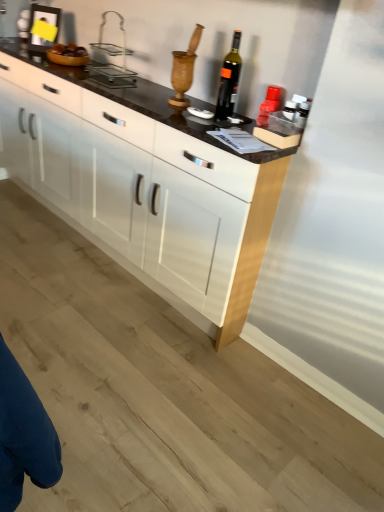
Question: From a real-world perspective, does white glossy cabinet at center stand above clear plastic basket at upper center?

Choices:
 (A) yes
 (B) no

Answer: (B)

Question: Is clear plastic basket at upper center a part of white glossy cabinet at center?

Choices:
 (A) no
 (B) yes

Answer: (A)

Question: Is white glossy cabinet at center taller than clear plastic basket at upper center?

Choices:
 (A) yes
 (B) no

Answer: (A)

Question: Is white glossy cabinet at center looking in the opposite direction of clear plastic basket at upper center?

Choices:
 (A) yes
 (B) no

Answer: (B)

Question: Does white glossy cabinet at center appear on the right side of clear plastic basket at upper center?

Choices:
 (A) no
 (B) yes

Answer: (A)

Question: Does white glossy cabinet at center turn towards clear plastic basket at upper center?

Choices:
 (A) no
 (B) yes

Answer: (A)

Question: Considering the relative positions of dark glass bottle at center and clear plastic basket at upper center in the image provided, is dark glass bottle at center to the right of clear plastic basket at upper center from the viewer's perspective?

Choices:
 (A) no
 (B) yes

Answer: (B)

Question: Is dark glass bottle at center wider than clear plastic basket at upper center?

Choices:
 (A) no
 (B) yes

Answer: (A)

Question: Is dark glass bottle at center beside clear plastic basket at upper center?

Choices:
 (A) no
 (B) yes

Answer: (A)

Question: From a real-world perspective, is dark glass bottle at center over clear plastic basket at upper center?

Choices:
 (A) yes
 (B) no

Answer: (A)

Question: Considering the relative positions of dark glass bottle at center and clear plastic basket at upper center in the image provided, is dark glass bottle at center to the left of clear plastic basket at upper center from the viewer's perspective?

Choices:
 (A) yes
 (B) no

Answer: (B)

Question: Can you confirm if dark glass bottle at center is shorter than clear plastic basket at upper center?

Choices:
 (A) yes
 (B) no

Answer: (B)

Question: Considering the relative sizes of dark glass bottle at center and white glossy cabinet at center in the image provided, is dark glass bottle at center shorter than white glossy cabinet at center?

Choices:
 (A) no
 (B) yes

Answer: (B)